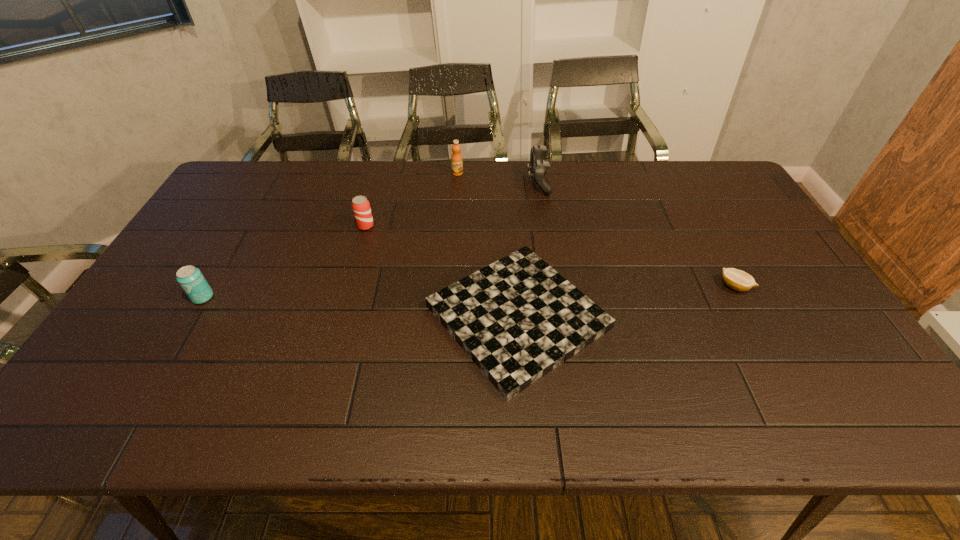
What are the coordinates of `orange juice` in the screenshot? It's located at click(456, 160).

The height and width of the screenshot is (540, 960). I want to click on control, so click(x=538, y=167).

Identify the location of the second object from left to right. The height and width of the screenshot is (540, 960). (360, 205).

Locate an element on the screen. the farther beer can is located at coordinates (360, 205).

The width and height of the screenshot is (960, 540). I want to click on the left beer can, so click(190, 278).

What are the coordinates of `the leftmost object` in the screenshot? It's located at (190, 278).

Find the location of a particular element. This screenshot has height=540, width=960. lemon is located at coordinates (739, 280).

Locate an element on the screen. the second shortest object is located at coordinates coord(739,280).

Locate an element on the screen. The height and width of the screenshot is (540, 960). checkerboard is located at coordinates (518, 319).

Where is `vacant space located on the front label of the orange juice`? vacant space located on the front label of the orange juice is located at coordinates (456, 193).